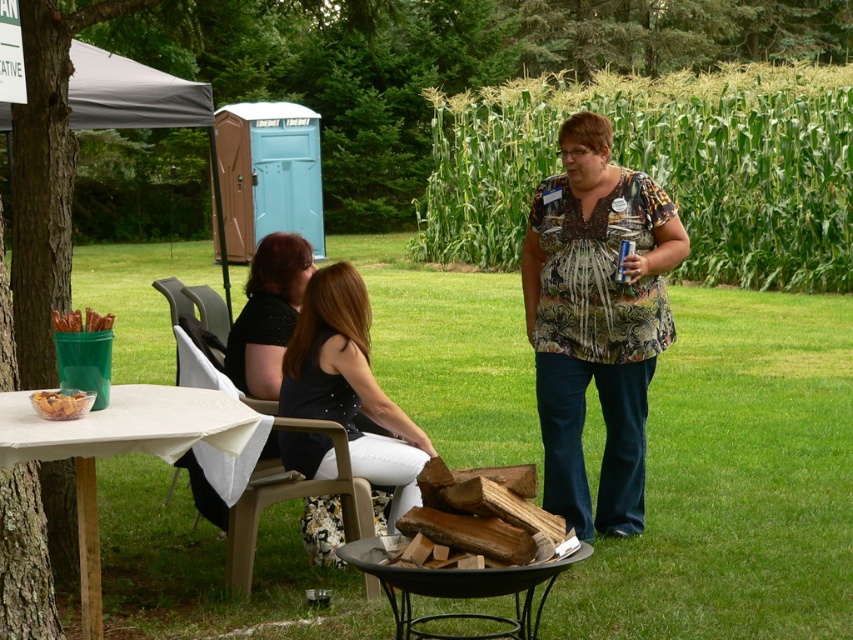
Is black fabric dress at center bigger than golden crispy chips at lower left?

Yes.

Is black fabric dress at center positioned at the back of golden crispy chips at lower left?

Yes, black fabric dress at center is behind golden crispy chips at lower left.

Locate an element on the screen. The height and width of the screenshot is (640, 853). black fabric dress at center is located at coordinates (350, 385).

Does green leafy corn at upper right come in front of black fabric dress at center?

No, it is not.

From the picture: Does green leafy corn at upper right have a larger size compared to black fabric dress at center?

Correct, green leafy corn at upper right is larger in size than black fabric dress at center.

You are a GUI agent. You are given a task and a screenshot of the screen. Output one action in this format:
    pyautogui.click(x=<x>, y=<y>)
    Task: Click on the green leafy corn at upper right
    The height and width of the screenshot is (640, 853).
    Given the screenshot: What is the action you would take?
    pyautogui.click(x=660, y=166)

Between green leafy corn at upper right and printed fabric blouse at center, which one is positioned lower?

printed fabric blouse at center

What do you see at coordinates (660, 166) in the screenshot? This screenshot has height=640, width=853. I see `green leafy corn at upper right` at bounding box center [660, 166].

The height and width of the screenshot is (640, 853). In order to click on green leafy corn at upper right in this screenshot , I will do `click(660, 166)`.